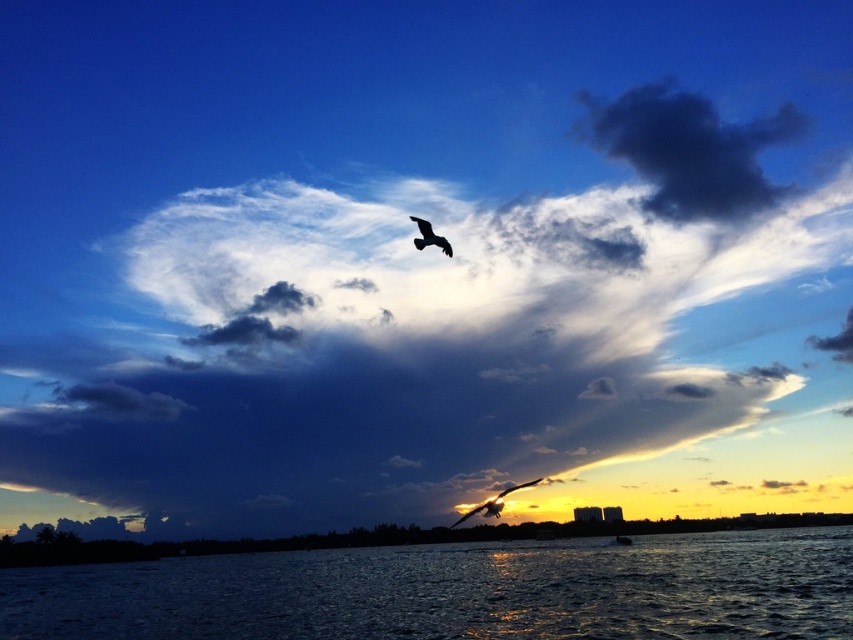
Is dark blue cloud at upper center to the left of silhouette feathered bird at center from the viewer's perspective?

Indeed, dark blue cloud at upper center is positioned on the left side of silhouette feathered bird at center.

Which of these two, dark blue cloud at upper center or silhouette feathered bird at center, stands taller?

dark blue cloud at upper center

Where is `dark blue cloud at upper center`? This screenshot has height=640, width=853. dark blue cloud at upper center is located at coordinates (451, 342).

The width and height of the screenshot is (853, 640). Identify the location of dark blue cloud at upper center. (451, 342).

What do you see at coordinates (451, 342) in the screenshot?
I see `dark blue cloud at upper center` at bounding box center [451, 342].

Does dark blue cloud at upper center appear under glistening dark water at lower center?

No, dark blue cloud at upper center is not below glistening dark water at lower center.

I want to click on dark blue cloud at upper center, so click(x=451, y=342).

Image resolution: width=853 pixels, height=640 pixels. I want to click on dark blue cloud at upper center, so click(451, 342).

Is glistening dark water at lower center positioned in front of silhouette feathered bird at center?

Yes, it is in front of silhouette feathered bird at center.

Who is higher up, glistening dark water at lower center or silhouette feathered bird at center?

silhouette feathered bird at center is higher up.

Locate an element on the screen. glistening dark water at lower center is located at coordinates (457, 592).

Locate an element on the screen. glistening dark water at lower center is located at coordinates (457, 592).